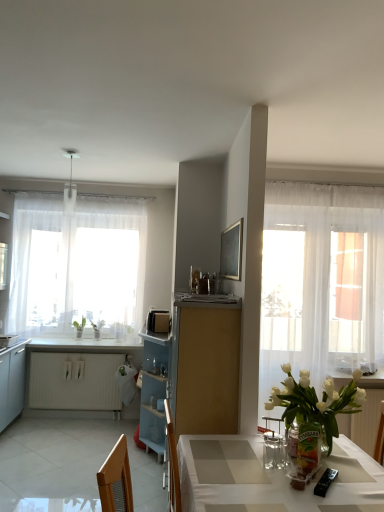
Where is `vacant space to the left of transparent glass vase at center-right`? vacant space to the left of transparent glass vase at center-right is located at coordinates (276, 468).